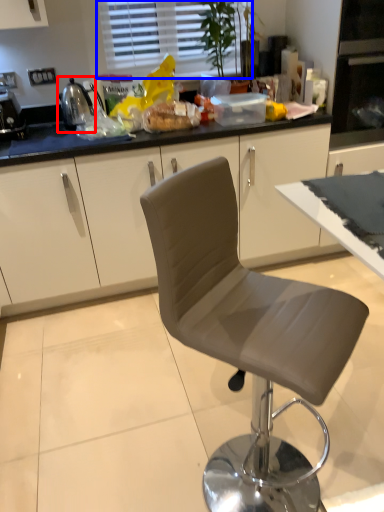
Question: Which object appears closest to the camera in this image, appliance (highlighted by a red box) or window (highlighted by a blue box)?

Choices:
 (A) appliance
 (B) window

Answer: (A)